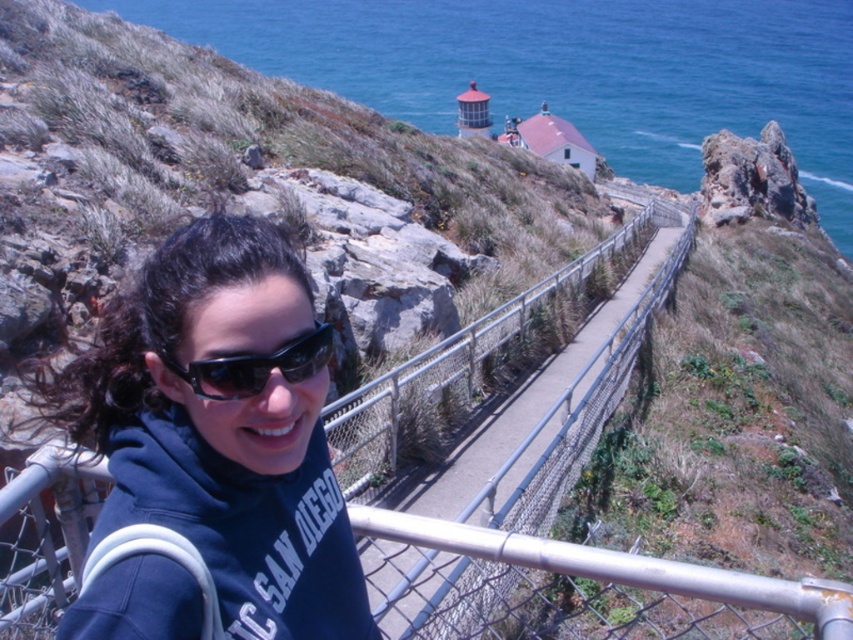
You are a photographer planning to take a wide shot of the coastal path. You notice the dark blue hoodie at center and the metal fence at center in your frame. Based on their sizes in the image, which object would you adjust your camera angle to focus on if you want to highlight the smaller subject?

The dark blue hoodie at center occupies less space than the metal fence at center, so you should adjust your camera angle to focus on the dark blue hoodie at center to highlight the smaller subject.

You are a photographer planning to capture a wide shot of the coastal path. Given that the blue water at upper center and the metal fence at center are both in the frame, which object will occupy more of the image area?

The blue water at upper center occupies more of the image area because it is larger in size than the metal fence at center.